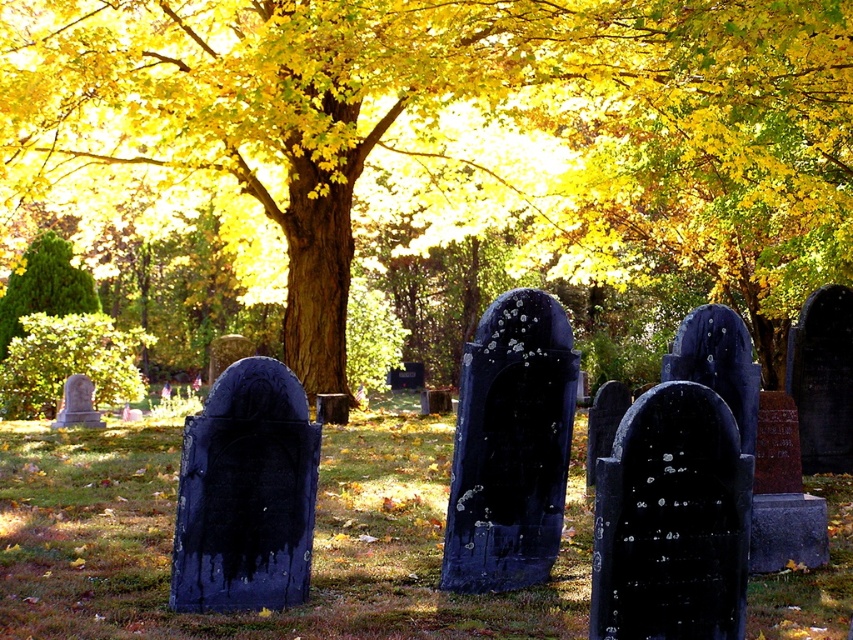
What is located at the point with coordinates (473, 104) in the cemetery scene?

The golden textured tree at center is located at point (473, 104).

You are a visitor at the cemetery and want to take a photo of the golden textured tree at center and the smooth gray stone at lower left. To ensure both are in the frame, which object should you position closer to the camera?

You should position the smooth gray stone at lower left closer to the camera because the golden textured tree at center is on the right side of it, so moving the smooth gray stone at lower left forward will keep both in the frame.

You are a photographer wanting to capture the golden textured tree at center and the green textured bush at left in your shot. Based on their positions, which object would appear closer to the camera in the photo?

The golden textured tree at center appears closer to the camera because it is in front of the green textured bush at left.